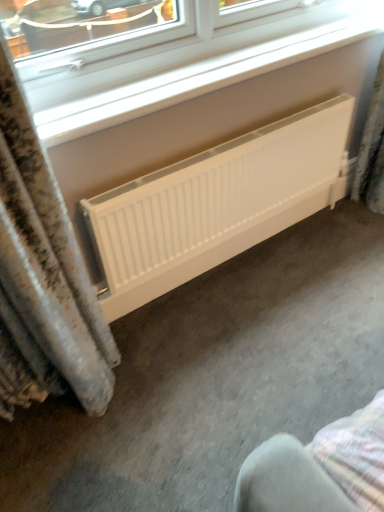
Locate an element on the screen. The height and width of the screenshot is (512, 384). empty space that is ontop of white plastic window at upper center is located at coordinates (265, 55).